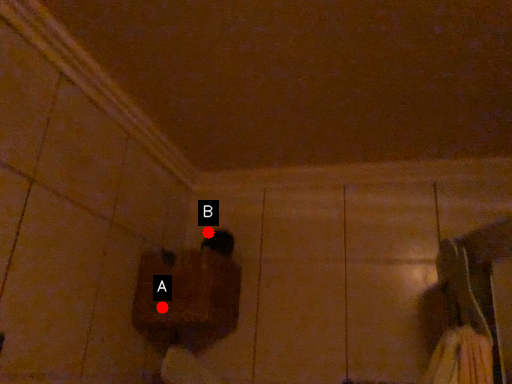
Question: Two points are circled on the image, labeled by A and B beside each circle. Among these points, which one is farthest from the camera?

Choices:
 (A) A is further
 (B) B is further

Answer: (B)